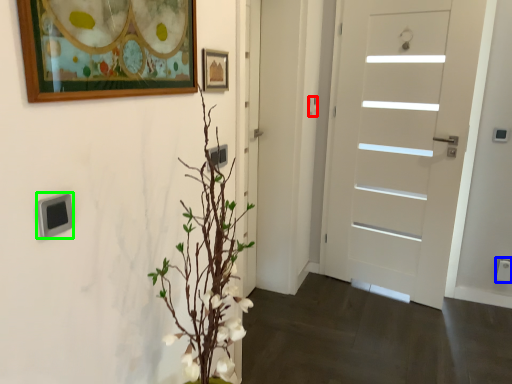
Question: Estimate the real-world distances between objects in this image. Which object is farther from door handle (highlighted by a red box), electric outlet (highlighted by a blue box) or light switch (highlighted by a green box)?

Choices:
 (A) electric outlet
 (B) light switch

Answer: (B)